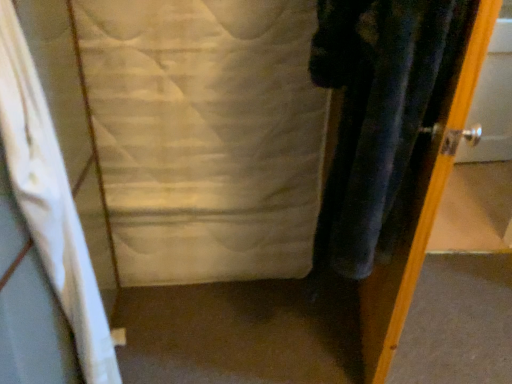
Locate an element on the screen. vacant area that is situated to the right of white quilted fabric at center is located at coordinates (306, 314).